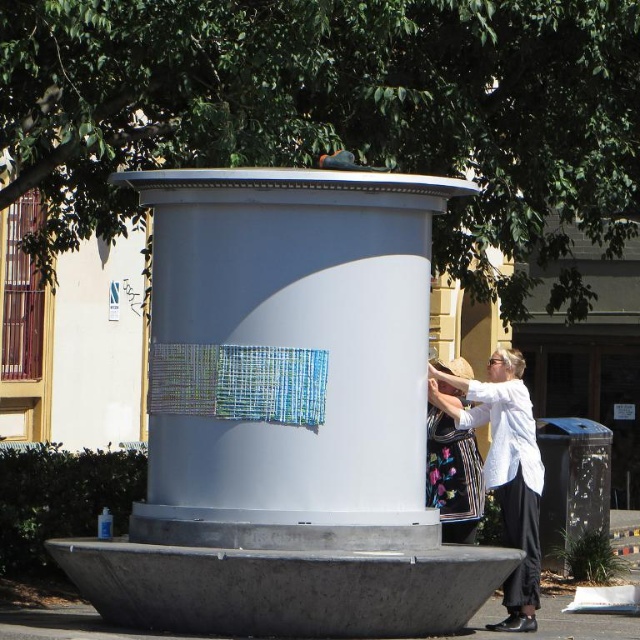
Which of these two, white cotton shirt at center or floral fabric bag at lower right, stands taller?

white cotton shirt at center is taller.

Who is more distant from viewer, (456,385) or (452,365)?

Positioned behind is point (452,365).

This screenshot has width=640, height=640. In order to click on white cotton shirt at center in this screenshot , I will do `click(506, 470)`.

Based on the photo, which is below, white matte fountain at center or white cotton shirt at center?

Positioned lower is white cotton shirt at center.

Based on the photo, is white matte fountain at center closer to the viewer compared to white cotton shirt at center?

Yes, white matte fountain at center is closer to the viewer.

At what (x,y) coordinates should I click in order to perform the action: click on white matte fountain at center. Please return your answer as a coordinate pair (x, y). The width and height of the screenshot is (640, 640). Looking at the image, I should click on (288, 416).

Based on the photo, between white matte fountain at center and floral fabric bag at lower right, which one appears on the left side from the viewer's perspective?

Positioned to the left is white matte fountain at center.

Between point (378, 225) and point (467, 476), which one is positioned behind?

The point (467, 476) is behind.

You are a GUI agent. You are given a task and a screenshot of the screen. Output one action in this format:
    pyautogui.click(x=<x>, y=<y>)
    Task: Click on the white matte fountain at center
    
    Given the screenshot: What is the action you would take?
    pyautogui.click(x=288, y=416)